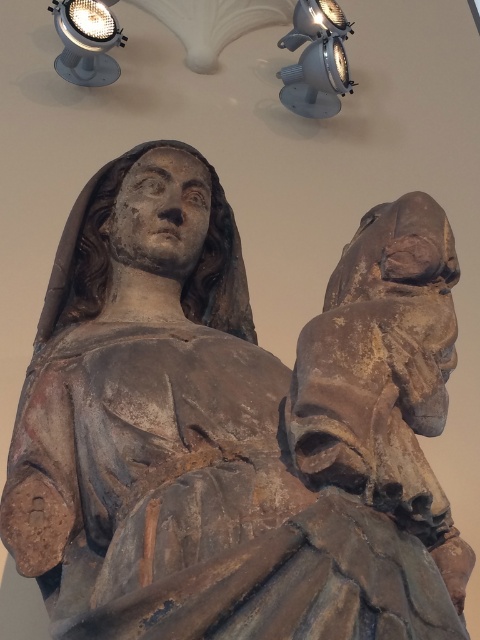
Question: Does metallic industrial spotlight at upper center come in front of matte silver spotlight at upper left?

Choices:
 (A) yes
 (B) no

Answer: (B)

Question: Considering the relative positions of metallic industrial spotlight at upper center and matte silver spotlight at upper left in the image provided, where is metallic industrial spotlight at upper center located with respect to matte silver spotlight at upper left?

Choices:
 (A) left
 (B) right

Answer: (B)

Question: Among these points, which one is farthest from the camera?

Choices:
 (A) (106, 65)
 (B) (315, 13)

Answer: (B)

Question: From the image, what is the correct spatial relationship of metallic industrial spotlight at upper center in relation to matte silver spotlight at upper left?

Choices:
 (A) above
 (B) below

Answer: (B)

Question: Which object appears closest to the camera in this image?

Choices:
 (A) metallic industrial spotlight at upper center
 (B) matte silver spotlight at upper left

Answer: (B)

Question: Among these points, which one is nearest to the camera?

Choices:
 (A) (303, 81)
 (B) (82, 12)

Answer: (B)